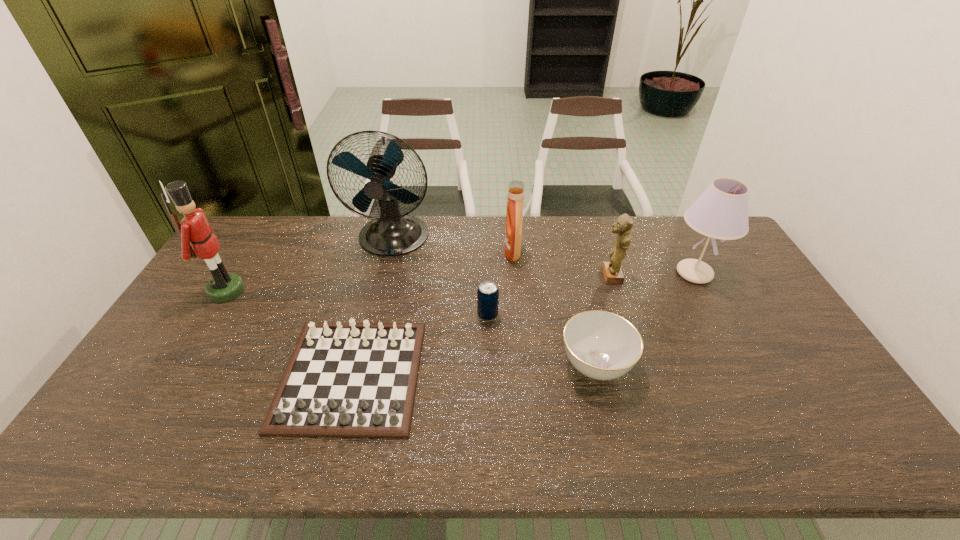
This screenshot has height=540, width=960. In order to click on object that is the fifth closest to the leftmost object in this screenshot , I will do `click(601, 345)`.

Choose which object is the fifth nearest neighbor to the figurine. Please provide its 2D coordinates. Your answer should be formatted as a tuple, i.e. [(x, y)], where the tuple contains the x and y coordinates of a point satisfying the conditions above.

[(391, 234)]

Where is `free spot that satisfies the following two spatial constraints: 1. on the back side of the chinaware; 2. on the front-facing side of the leftmost object`? This screenshot has width=960, height=540. free spot that satisfies the following two spatial constraints: 1. on the back side of the chinaware; 2. on the front-facing side of the leftmost object is located at coordinates (578, 291).

Locate an element on the screen. The image size is (960, 540). free point that satisfies the following two spatial constraints: 1. on the back side of the chinaware; 2. on the front-facing side of the fifth object from left to right is located at coordinates (568, 252).

What are the coordinates of `free space that satisfies the following two spatial constraints: 1. on the front-facing side of the sixth shortest object; 2. on the right side of the detergent` in the screenshot? It's located at (515, 273).

Where is `vacant space that satisfies the following two spatial constraints: 1. on the front-facing side of the sixth shortest object; 2. on the left side of the fan`? vacant space that satisfies the following two spatial constraints: 1. on the front-facing side of the sixth shortest object; 2. on the left side of the fan is located at coordinates tap(385, 273).

Where is `vacant space that satisfies the following two spatial constraints: 1. on the front-facing side of the lampshade; 2. on the left side of the fan`? The height and width of the screenshot is (540, 960). vacant space that satisfies the following two spatial constraints: 1. on the front-facing side of the lampshade; 2. on the left side of the fan is located at coordinates (385, 273).

Where is `free space that satisfies the following two spatial constraints: 1. on the front-facing side of the third nearest object; 2. on the left side of the nutcracker`? The height and width of the screenshot is (540, 960). free space that satisfies the following two spatial constraints: 1. on the front-facing side of the third nearest object; 2. on the left side of the nutcracker is located at coordinates (212, 315).

In order to click on free space that satisfies the following two spatial constraints: 1. on the back side of the soda can; 2. on the front-facing side of the nutcracker in this screenshot , I will do `click(488, 291)`.

This screenshot has width=960, height=540. What are the coordinates of `vacant space that satisfies the following two spatial constraints: 1. on the front-facing side of the nutcracker; 2. on the back side of the shortest object` in the screenshot? It's located at (176, 375).